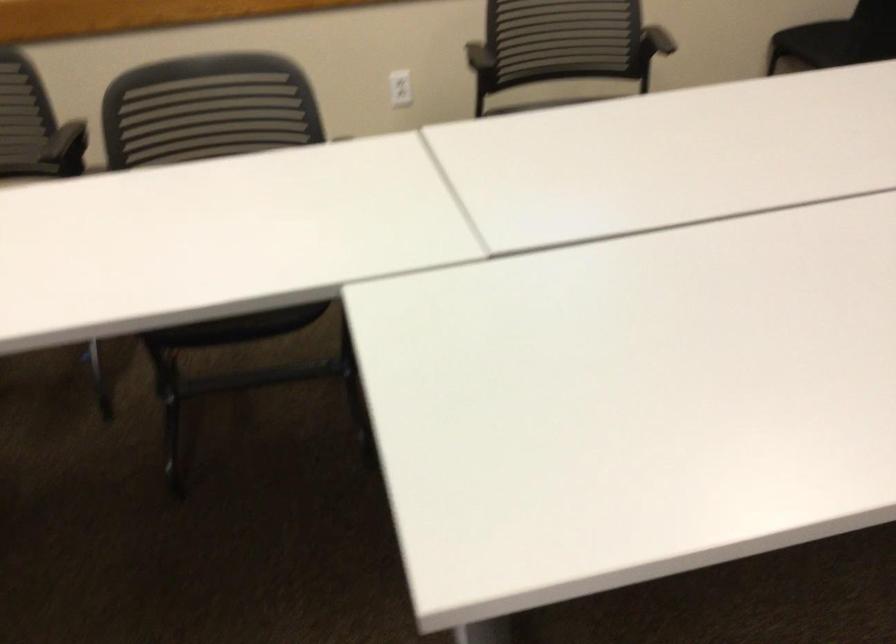
What do you see at coordinates (558, 41) in the screenshot?
I see `a chair sitting surface` at bounding box center [558, 41].